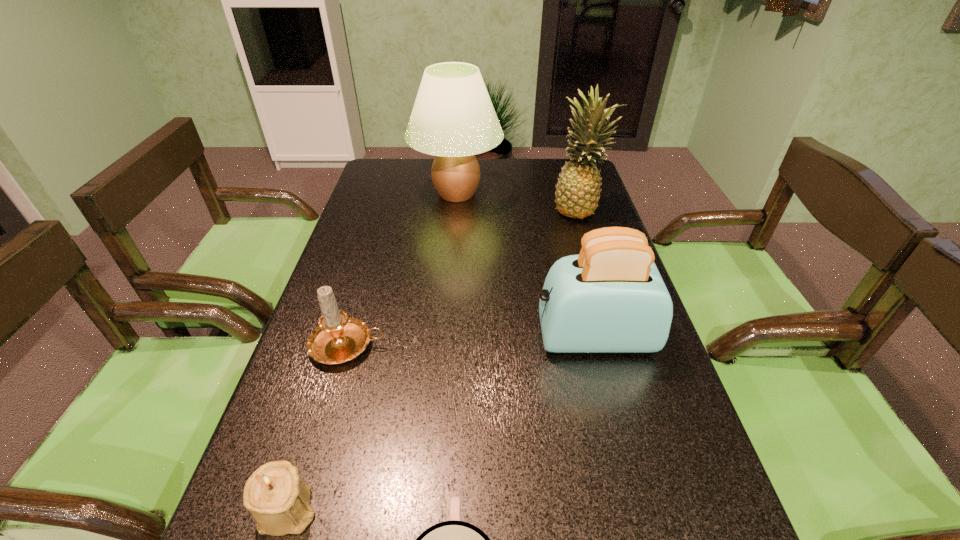
Find the location of `lampshade`. lampshade is located at coordinates (453, 118).

You are a GUI agent. You are given a task and a screenshot of the screen. Output one action in this format:
    pyautogui.click(x=<x>, y=<y>)
    Task: Click on the pineapple
    
    Given the screenshot: What is the action you would take?
    pyautogui.click(x=577, y=192)

Locate an element on the screen. the fourth shortest object is located at coordinates (610, 298).

In order to click on candle in this screenshot , I will do `click(338, 338)`.

Identify the location of candle_holder. Image resolution: width=960 pixels, height=540 pixels. tap(278, 500).

The width and height of the screenshot is (960, 540). What are the coordinates of `blank area located 0.310m on the shade of the lampshade` in the screenshot? It's located at (596, 194).

Identify the location of blank space located on the back of the pineapple. This screenshot has width=960, height=540. (569, 178).

Locate an element on the screen. Image resolution: width=960 pixels, height=540 pixels. blank area located 0.130m on the side of the fourth shortest object with the lever is located at coordinates (477, 337).

I want to click on vacant area situated on the side of the fourth shortest object with the lever, so click(x=356, y=337).

This screenshot has height=540, width=960. Identify the location of free point located on the side of the fourth shortest object with the lever. (379, 337).